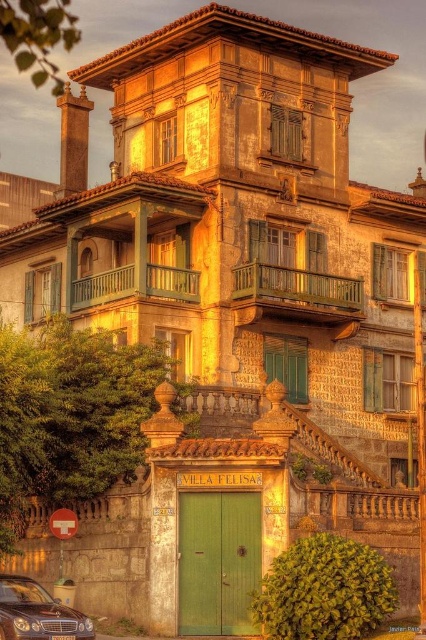
Question: Can you confirm if green wooden balcony at center is positioned to the left of wooden balcony at center?

Choices:
 (A) no
 (B) yes

Answer: (A)

Question: Which of the following is the closest to the observer?

Choices:
 (A) pos(293,269)
 (B) pos(16,636)

Answer: (B)

Question: Among these points, which one is farthest from the camera?

Choices:
 (A) (239, 282)
 (B) (29, 618)
 (C) (178, 269)

Answer: (C)

Question: Does green wooden balcony at center lie behind shiny dark brown car at lower left?

Choices:
 (A) no
 (B) yes

Answer: (B)

Question: Which object is the closest to the green wooden balcony at center?

Choices:
 (A) shiny dark brown car at lower left
 (B) wooden balcony at center

Answer: (B)

Question: Is green wooden balcony at center to the right of shiny dark brown car at lower left from the viewer's perspective?

Choices:
 (A) no
 (B) yes

Answer: (B)